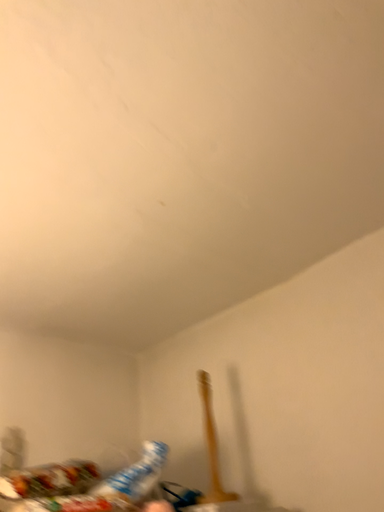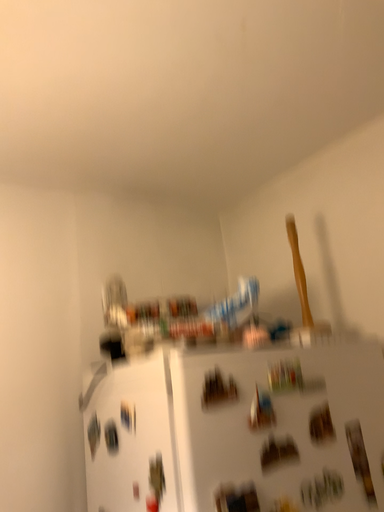
Question: Which way did the camera rotate in the video?

Choices:
 (A) rotated downward
 (B) rotated upward

Answer: (A)